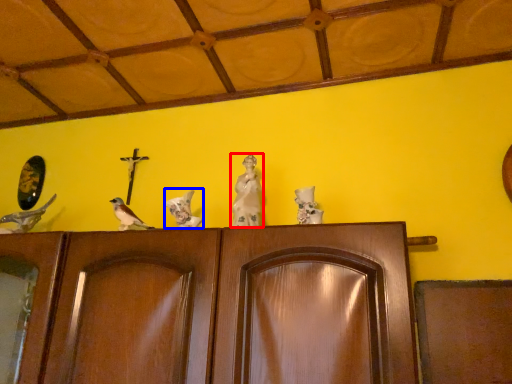
Question: Which point is closer to the camera, sculpture (highlighted by a red box) or bird (highlighted by a blue box)?

Choices:
 (A) sculpture
 (B) bird

Answer: (A)